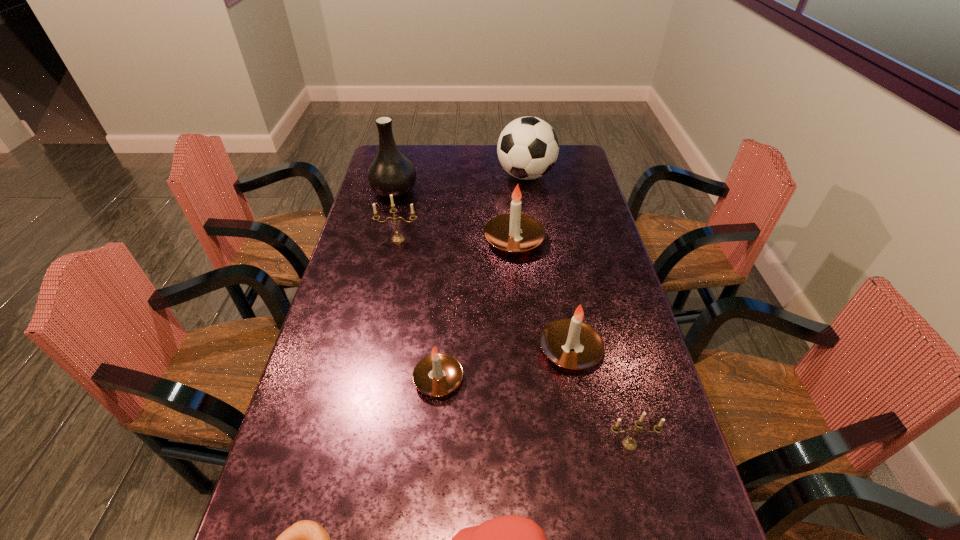
Where is `the nearer metallic candle`? the nearer metallic candle is located at coordinates (629, 443).

Find the location of a particular element. The image size is (960, 540). vacant region located 0.230m on the right of the tallest object is located at coordinates (476, 191).

Locate an element on the screen. vacant space situated on the back of the black soccer ball is located at coordinates (521, 147).

Find the location of a particular element. vacant space situated on the front of the farthest white candle is located at coordinates (522, 339).

At what (x,y) coordinates should I click in order to perform the action: click on vacant space located 0.120m on the left of the second smallest white candle. Please return your answer as a coordinate pair (x, y). Looking at the image, I should click on (494, 350).

Find the location of a particular element. Image resolution: width=960 pixels, height=540 pixels. free space located 0.060m on the front of the farther metallic candle is located at coordinates [x=395, y=255].

In order to click on vacant space located on the front of the leftmost white candle in this screenshot , I will do [427, 518].

Locate an element on the screen. Image resolution: width=960 pixels, height=540 pixels. vacant area situated on the back of the smaller metallic candle is located at coordinates (612, 376).

This screenshot has width=960, height=540. What are the coordinates of `object located at the far edge` in the screenshot? It's located at (528, 147).

I want to click on vase that is at the left edge, so [390, 172].